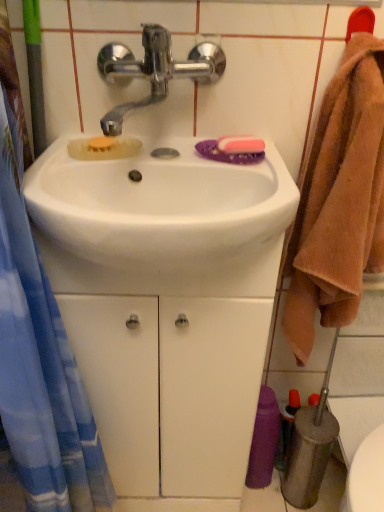
Question: In the image, is brown fluffy towel at right on the left side or the right side of white glossy sink at center?

Choices:
 (A) right
 (B) left

Answer: (A)

Question: Which is correct: brown fluffy towel at right is inside white glossy sink at center, or outside of it?

Choices:
 (A) inside
 (B) outside

Answer: (B)

Question: Estimate the real-world distances between objects in this image. Which object is closer to the brown fluffy towel at right?

Choices:
 (A) shiny metallic faucet at upper center
 (B) white glossy cabinet at center
 (C) purple fabric towel at lower right
 (D) white glossy sink at center

Answer: (D)

Question: Estimate the real-world distances between objects in this image. Which object is closer to the white glossy sink at center?

Choices:
 (A) shiny metallic faucet at upper center
 (B) purple fabric towel at lower right
 (C) white glossy cabinet at center
 (D) brown fluffy towel at right

Answer: (A)